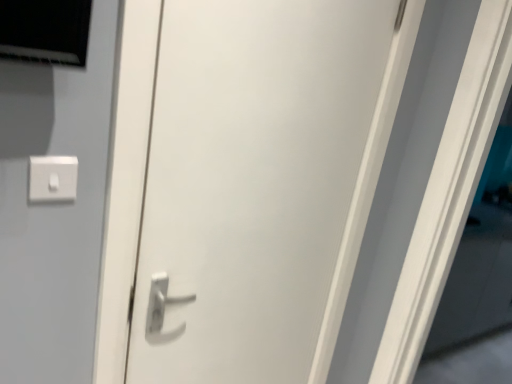
Where is `white matte door at center`? This screenshot has height=384, width=512. white matte door at center is located at coordinates (260, 183).

Describe the element at coordinates (260, 183) in the screenshot. I see `white matte door at center` at that location.

What is the approximate width of white matte door at center?

2.32 inches.

Find the location of `white matte door at center`. white matte door at center is located at coordinates (260, 183).